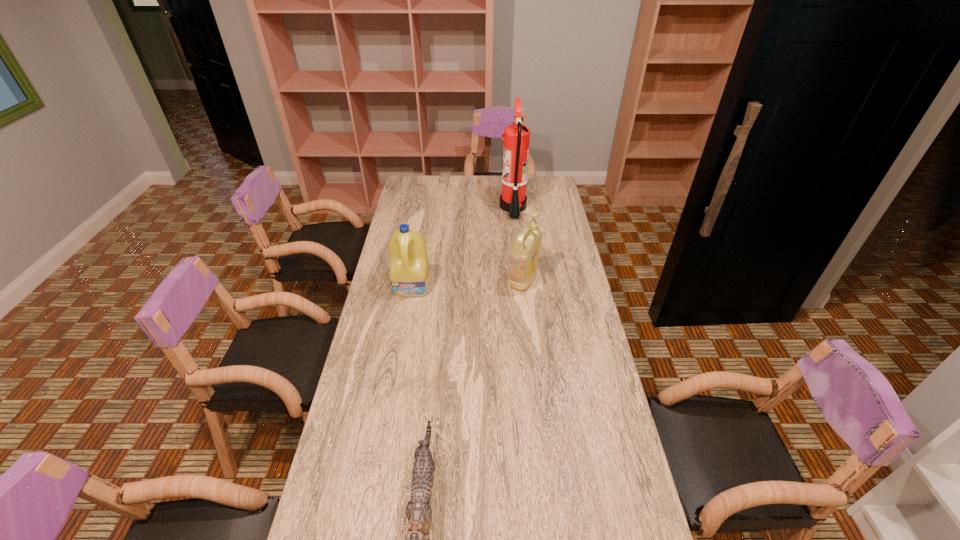
This screenshot has width=960, height=540. Identify the location of object present at the left edge. (409, 270).

This screenshot has width=960, height=540. In the image, there is a desktop. Identify the location of free space at the far edge. (444, 182).

At what (x,y) coordinates should I click in order to perform the action: click on vacant area at the left edge of the desktop. Please return your answer as a coordinate pair (x, y). This screenshot has width=960, height=540. Looking at the image, I should click on point(379,517).

The height and width of the screenshot is (540, 960). In order to click on free region at the right edge of the desktop in this screenshot , I will do `click(574, 364)`.

The width and height of the screenshot is (960, 540). I want to click on vacant point at the far right corner, so click(x=552, y=191).

Where is `vacant space that is in between the leftmost object and the fire extinguisher`? The width and height of the screenshot is (960, 540). vacant space that is in between the leftmost object and the fire extinguisher is located at coordinates (463, 246).

Find the location of a particular element. This screenshot has height=540, width=960. free spot between the leftmost object and the right detergent is located at coordinates (468, 282).

You are a GUI agent. You are given a task and a screenshot of the screen. Output one action in this format:
    pyautogui.click(x=<x>, y=<y>)
    Task: Click on the free space between the right detergent and the left detergent
    The image size is (960, 540).
    Given the screenshot: What is the action you would take?
    pyautogui.click(x=468, y=282)

Identify the location of empty location between the tallest object and the left detergent. Image resolution: width=960 pixels, height=540 pixels. (463, 246).

The image size is (960, 540). Identify the location of vacant space in between the farthest object and the left detergent. [x=463, y=246].